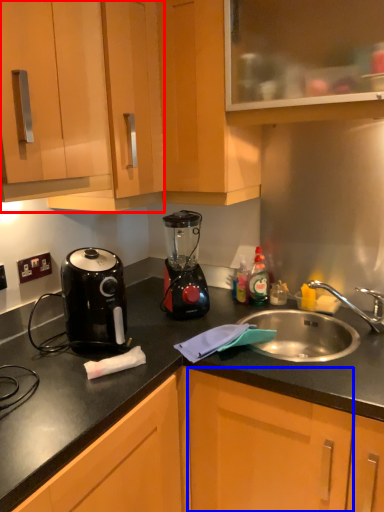
Question: Which of the following is the closest to the observer, cabinetry (highlighted by a red box) or cabinetry (highlighted by a blue box)?

Choices:
 (A) cabinetry
 (B) cabinetry

Answer: (B)